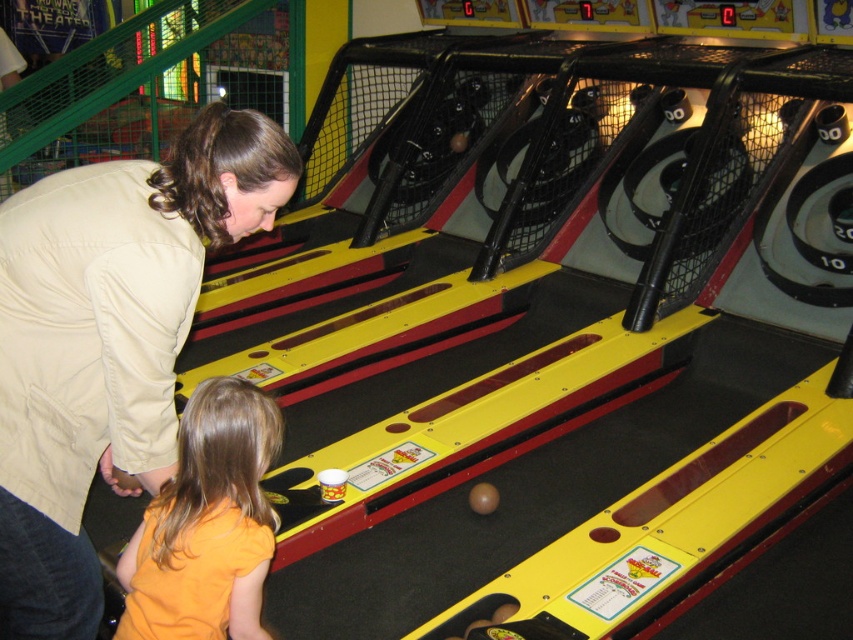
Question: Which point is closer to the camera?

Choices:
 (A) orange cotton shirt at lower left
 (B) beige fabric shirt at center

Answer: (B)

Question: Does beige fabric shirt at center have a greater width compared to orange cotton shirt at lower left?

Choices:
 (A) yes
 (B) no

Answer: (A)

Question: Is beige fabric shirt at center further to camera compared to orange cotton shirt at lower left?

Choices:
 (A) no
 (B) yes

Answer: (A)

Question: Is beige fabric shirt at center closer to camera compared to orange cotton shirt at lower left?

Choices:
 (A) yes
 (B) no

Answer: (A)

Question: Among these points, which one is nearest to the camera?

Choices:
 (A) (112, 166)
 (B) (190, 525)

Answer: (A)